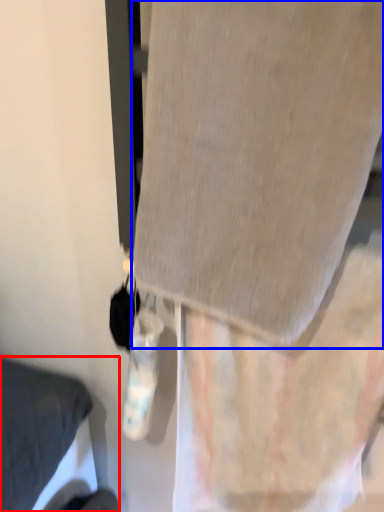
Question: Which of the following is the farthest to the observer, furniture (highlighted by a red box) or fabric (highlighted by a blue box)?

Choices:
 (A) furniture
 (B) fabric

Answer: (A)